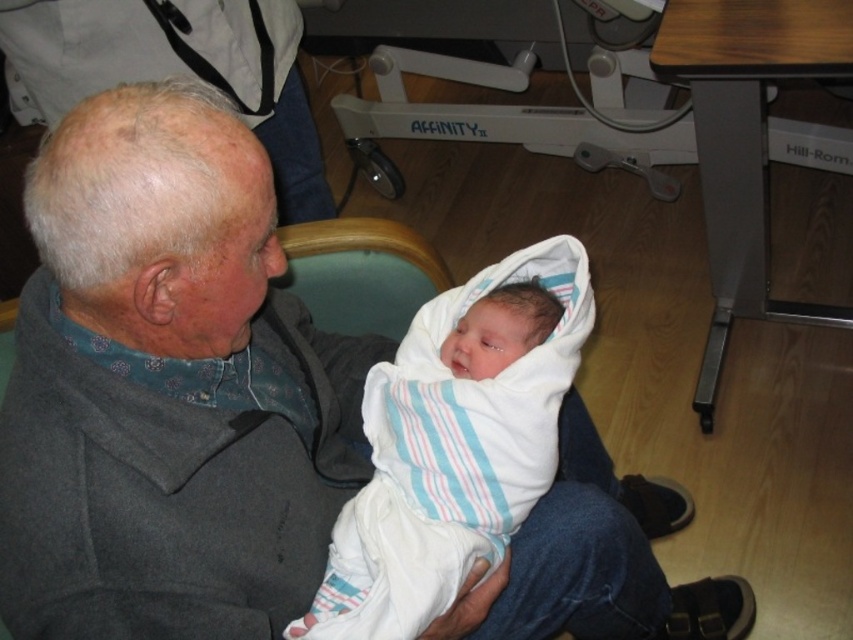
Question: Does gray woolen sweater at upper left appear on the right side of white striped swaddle at center?

Choices:
 (A) no
 (B) yes

Answer: (A)

Question: Does gray woolen sweater at upper left appear on the right side of white striped swaddle at center?

Choices:
 (A) no
 (B) yes

Answer: (A)

Question: Is gray woolen sweater at upper left wider than white striped swaddle at center?

Choices:
 (A) no
 (B) yes

Answer: (B)